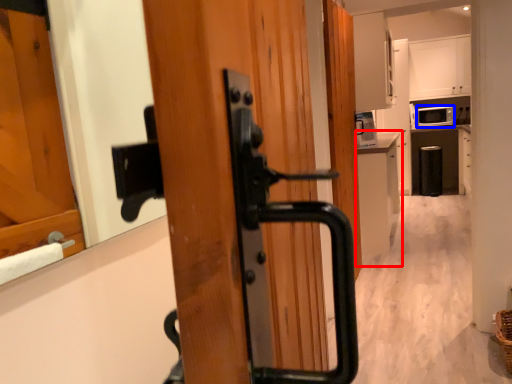
Question: Which point is further to the camera, cabinetry (highlighted by a red box) or appliance (highlighted by a blue box)?

Choices:
 (A) cabinetry
 (B) appliance

Answer: (B)